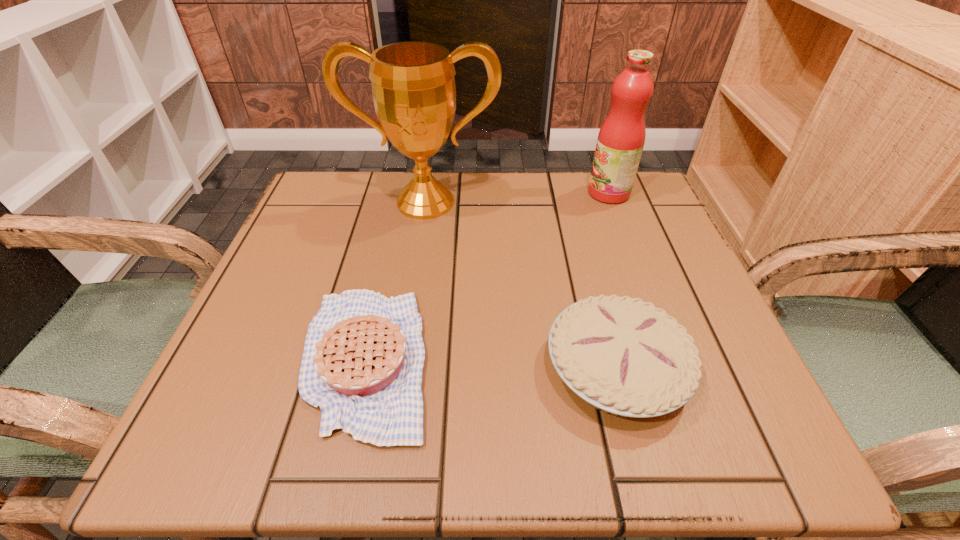
Where is `object at the far right corner`? The width and height of the screenshot is (960, 540). object at the far right corner is located at coordinates (620, 142).

At what (x,y) coordinates should I click in order to perform the action: click on object that is at the near right corner. Please return your answer as a coordinate pair (x, y). Image resolution: width=960 pixels, height=540 pixels. Looking at the image, I should click on (624, 356).

Where is `vacant area at the far edge`? vacant area at the far edge is located at coordinates tap(547, 174).

This screenshot has height=540, width=960. I want to click on vacant space at the near edge of the desktop, so click(592, 439).

In the image, there is a desktop. Where is `vacant space at the left edge`? The image size is (960, 540). vacant space at the left edge is located at coordinates [x=356, y=256].

The height and width of the screenshot is (540, 960). In the image, there is a desktop. What are the coordinates of `vacant space at the right edge` in the screenshot? It's located at (639, 246).

Locate an element on the screen. This screenshot has width=960, height=540. vacant space at the far left corner is located at coordinates (318, 194).

Find the location of `vacant space at the far right corner of the desktop`. vacant space at the far right corner of the desktop is located at coordinates (613, 204).

Find the location of `vacant space at the near right corner of the desktop`. vacant space at the near right corner of the desktop is located at coordinates (689, 430).

Find the location of a particular element. free space between the shortest object and the right pie is located at coordinates (491, 364).